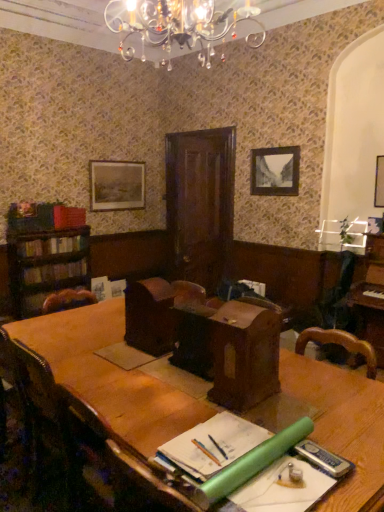
Question: Looking at the image, does wooden picture frame at upper right, the 1th picture frame in the front-to-back sequence, seem bigger or smaller compared to wooden picture frame at upper center, placed as the second picture frame when sorted from front to back?

Choices:
 (A) small
 (B) big

Answer: (A)

Question: Visually, is wooden picture frame at upper right, the 3th picture frame in the left-to-right sequence, positioned to the left or to the right of wooden picture frame at upper center, the 2th picture frame when ordered from back to front?

Choices:
 (A) left
 (B) right

Answer: (B)

Question: Estimate the real-world distances between objects in this image. Which object is farther from the wooden picture frame at upper center, the 2th picture frame when ordered from back to front?

Choices:
 (A) wooden chair at lower left
 (B) wooden table at center
 (C) dark brown leather bookshelf at left, placed as the first book when sorted from bottom to top
 (D) hardcover books at left, the second book from the top
 (E) brown leather armchair at center, the first armchair when ordered from left to right

Answer: (A)

Question: Which of these objects is positioned farthest from the crystal chandelier at upper center?

Choices:
 (A) wooden picture frame at upper left, the third picture frame positioned from the right
 (B) wooden picture frame at upper right, the first picture frame in the right-to-left sequence
 (C) wooden chair at lower left
 (D) hardcover books at left, which is the second book in bottom-to-top order
 (E) wooden table at center

Answer: (A)